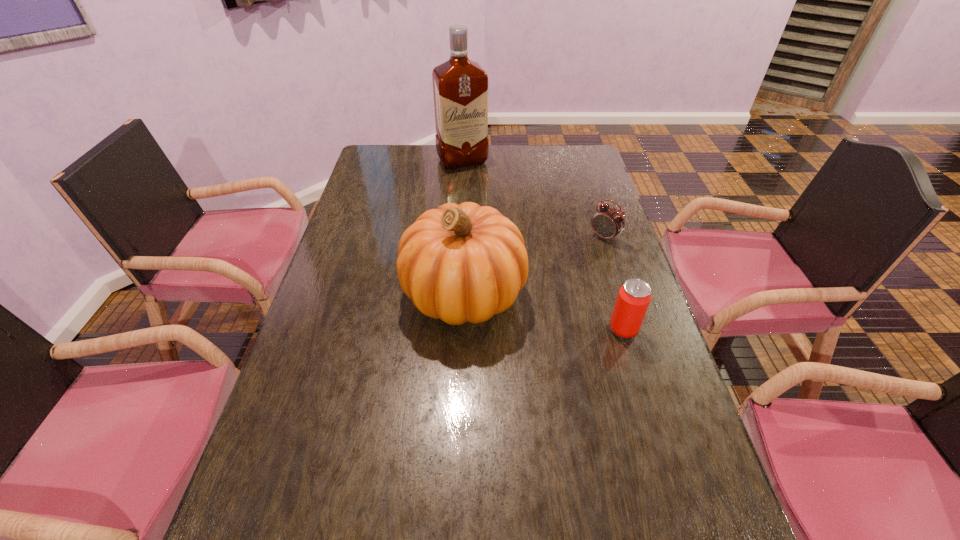
The width and height of the screenshot is (960, 540). What are the coordinates of `unoccupied area between the beer can and the pumpkin` in the screenshot? It's located at (543, 312).

Locate an element on the screen. The width and height of the screenshot is (960, 540). free spot between the second farthest object and the liquor is located at coordinates (534, 199).

Find the location of a particular element. This screenshot has width=960, height=540. object that stands as the third closest to the alarm clock is located at coordinates (460, 86).

The width and height of the screenshot is (960, 540). Find the location of `the closest object to the third shortest object`. the closest object to the third shortest object is located at coordinates (634, 297).

At what (x,y) coordinates should I click in order to perform the action: click on free spot that satisfies the following two spatial constraints: 1. on the front side of the third nearest object; 2. on the left side of the farthest object. Please return your answer as a coordinate pair (x, y). Looking at the image, I should click on (458, 237).

At what (x,y) coordinates should I click in order to perform the action: click on vacant area in the image that satisfies the following two spatial constraints: 1. on the back side of the third nearest object; 2. on the left side of the pumpkin. Please return your answer as a coordinate pair (x, y). Image resolution: width=960 pixels, height=540 pixels. Looking at the image, I should click on (466, 237).